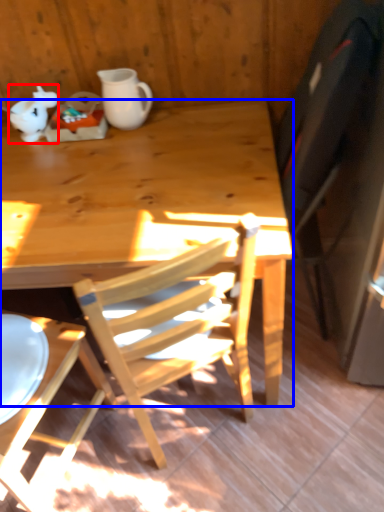
Question: Among these objects, which one is nearest to the camera, teapot (highlighted by a red box) or desk (highlighted by a blue box)?

Choices:
 (A) teapot
 (B) desk

Answer: (B)